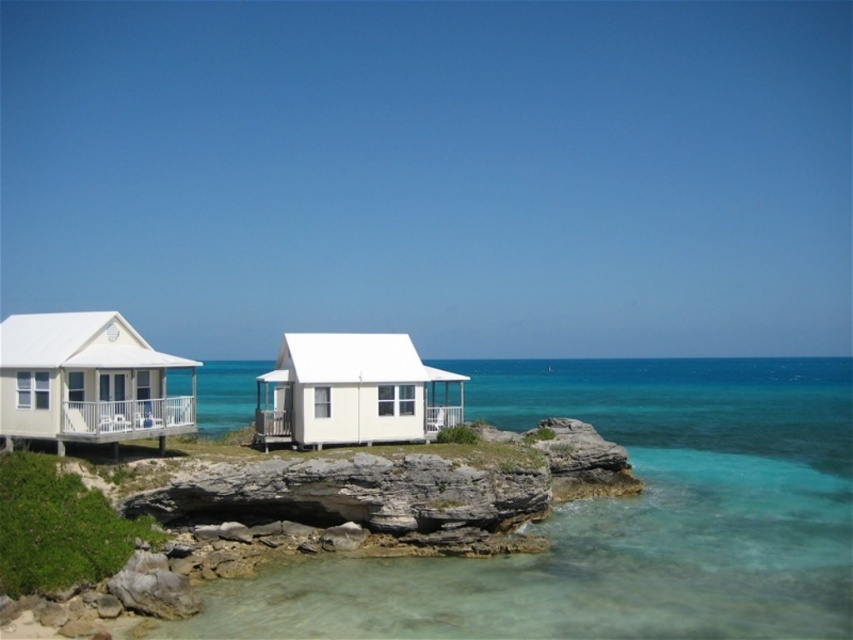
Can you confirm if clear glass water at center is taller than white matte cabin at left?

Indeed, clear glass water at center has a greater height compared to white matte cabin at left.

Find the location of a particular element. clear glass water at center is located at coordinates (621, 518).

Is point (747, 548) more distant than point (392, 340)?

That is False.

Is point (799, 378) farther from viewer compared to point (329, 404)?

Yes, it is behind point (329, 404).

This screenshot has width=853, height=640. I want to click on clear glass water at center, so click(x=621, y=518).

Does white matte cabin at left appear on the right side of white matte cabin at center?

No, white matte cabin at left is not to the right of white matte cabin at center.

Who is taller, white matte cabin at left or white matte cabin at center?

Standing taller between the two is white matte cabin at left.

Who is more distant from viewer, (x=88, y=349) or (x=265, y=374)?

Point (x=265, y=374)

Locate an element on the screen. The image size is (853, 640). white matte cabin at left is located at coordinates (86, 381).